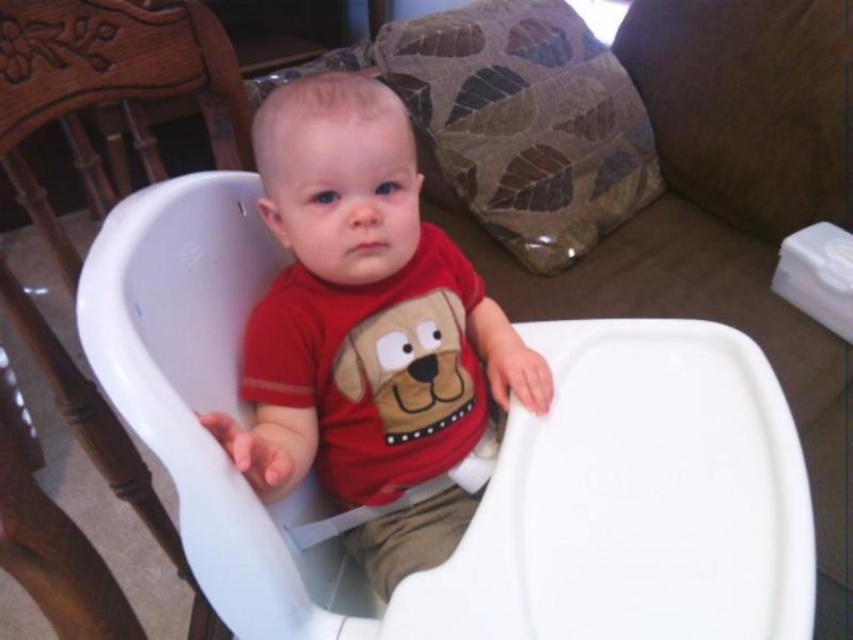
Does white plastic feeding chair at center have a larger size compared to matte red shirt at center?

Correct, white plastic feeding chair at center is larger in size than matte red shirt at center.

Between point (186, 440) and point (318, 173), which one is positioned in front?

Positioned in front is point (186, 440).

Locate an element on the screen. Image resolution: width=853 pixels, height=640 pixels. white plastic feeding chair at center is located at coordinates (492, 477).

Measure the distance between matte red shirt at center and camera.

18.28 inches

Can you confirm if matte red shirt at center is positioned below white plastic highchair at center?

Incorrect, matte red shirt at center is not positioned below white plastic highchair at center.

What are the coordinates of `matte red shirt at center` in the screenshot? It's located at (369, 332).

What are the coordinates of `matte red shirt at center` in the screenshot? It's located at (369, 332).

Does point (271, 540) come in front of point (120, 81)?

Yes, point (271, 540) is in front of point (120, 81).

Does white plastic feeding chair at center have a smaller size compared to white plastic highchair at center?

No.

At what (x,y) coordinates should I click in order to perform the action: click on white plastic feeding chair at center. Please return your answer as a coordinate pair (x, y). This screenshot has width=853, height=640. Looking at the image, I should click on (x=492, y=477).

Locate an element on the screen. white plastic feeding chair at center is located at coordinates (492, 477).